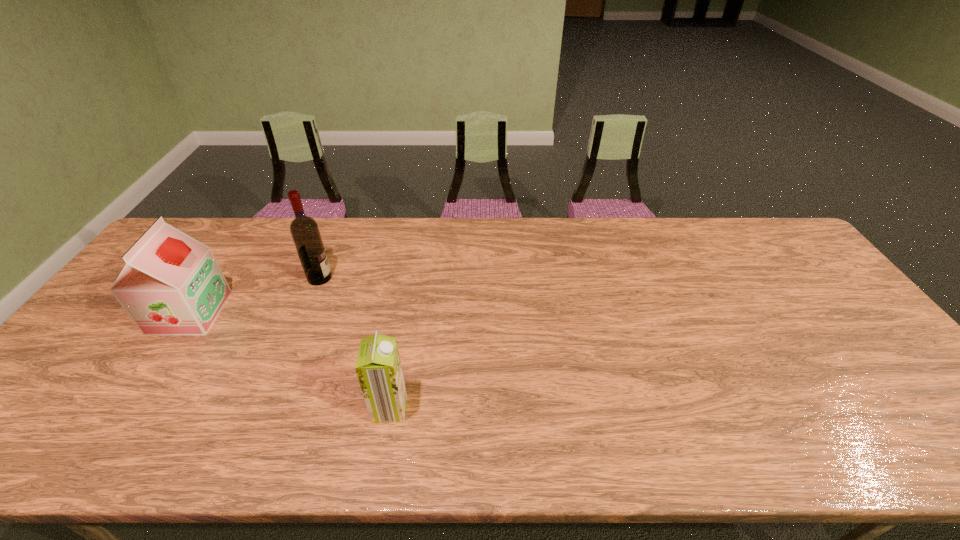
Where is `vacant area that lies between the shortest object and the leftmost object`? The height and width of the screenshot is (540, 960). vacant area that lies between the shortest object and the leftmost object is located at coordinates (290, 361).

At what (x,y) coordinates should I click in order to perform the action: click on vacant point located between the nearest object and the second farthest object. Please return your answer as a coordinate pair (x, y). This screenshot has height=540, width=960. Looking at the image, I should click on (290, 361).

Locate an element on the screen. This screenshot has height=540, width=960. blank region between the rightmost object and the farthest object is located at coordinates (354, 343).

Locate an element on the screen. This screenshot has height=540, width=960. free point between the nearest object and the leftmost object is located at coordinates (290, 361).

Where is `free space between the farther soya milk and the second object from left to right`? free space between the farther soya milk and the second object from left to right is located at coordinates (254, 295).

Image resolution: width=960 pixels, height=540 pixels. Identify the location of free space between the farther soya milk and the shortest object. (290, 361).

Identify the location of object that can be found as the second closest to the alcohol. (378, 366).

Select which object is the closest to the farthest object. Please provide its 2D coordinates. Your answer should be formatted as a tuple, i.e. [(x, y)], where the tuple contains the x and y coordinates of a point satisfying the conditions above.

[(171, 284)]

Locate an element on the screen. vacant space that satisfies the following two spatial constraints: 1. with the cap open on the right soya milk; 2. on the right side of the left soya milk is located at coordinates coord(126,408).

In order to click on blank space that satisfies the following two spatial constraints: 1. on the front and back of the second object from left to right; 2. on the back side of the rightmost object in this screenshot , I will do tap(267, 408).